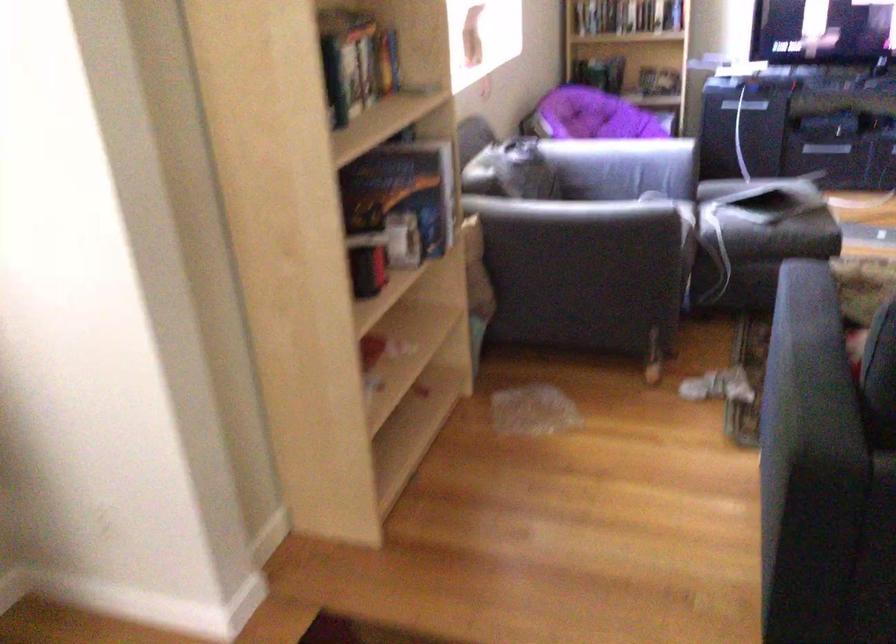
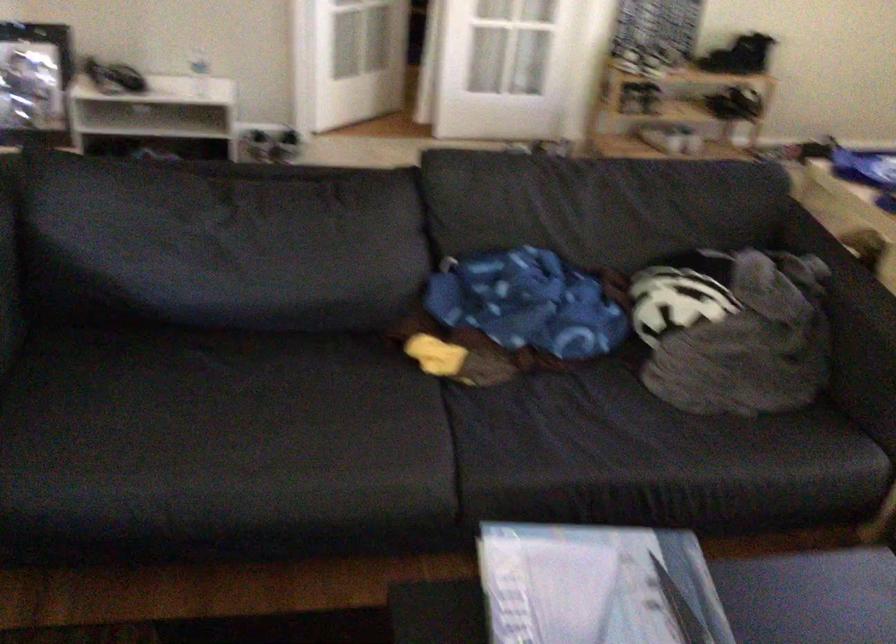
The images are taken continuously from a first-person perspective. In which direction is your viewpoint rotating?

The camera's rotation is toward right-down.